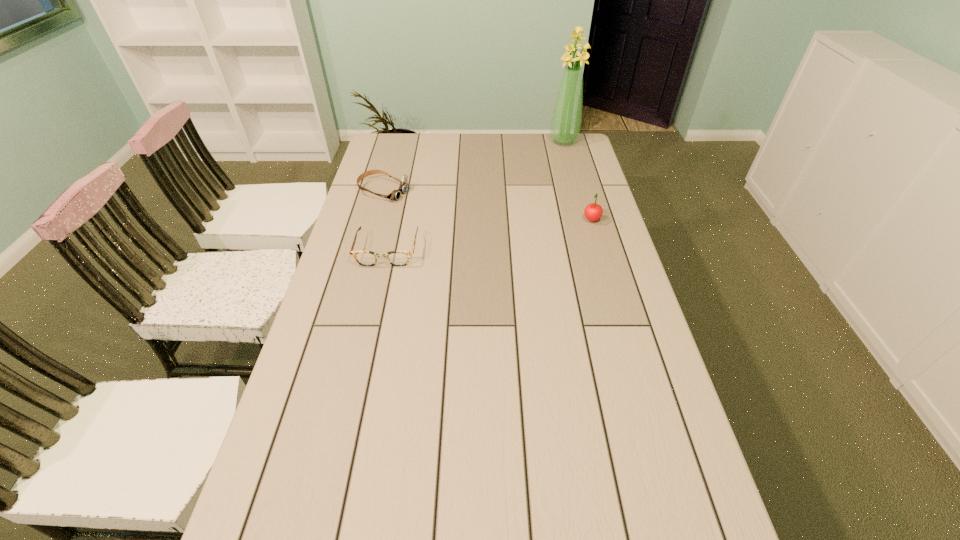
You are a GUI agent. You are given a task and a screenshot of the screen. Output one action in this format:
    pyautogui.click(x=<x>, y=<y>)
    Task: Click on the vacant space located 0.220m on the front-facing side of the second farthest object
    This screenshot has width=960, height=540.
    Given the screenshot: What is the action you would take?
    pyautogui.click(x=459, y=212)

Where is `free space located 0.220m on the front-facing side of the farthest object`? free space located 0.220m on the front-facing side of the farthest object is located at coordinates (548, 175).

This screenshot has width=960, height=540. In order to click on free space located on the front-facing side of the farthest object in this screenshot , I will do `click(542, 187)`.

Identify the location of vacant space located 0.330m on the front-facing side of the farthest object. (541, 190).

Locate an element on the screen. object at the far edge is located at coordinates (566, 119).

Where is `spectacles at the left edge`? This screenshot has width=960, height=540. spectacles at the left edge is located at coordinates [x=365, y=258].

This screenshot has width=960, height=540. Identify the location of goggles present at the left edge. (395, 194).

Locate an element on the screen. cherry that is at the right edge is located at coordinates (593, 212).

What are the coordinates of `bouquet that is at the right edge` in the screenshot? It's located at (566, 119).

Find the location of a particular element. object that is positioned at the far right corner is located at coordinates (566, 119).